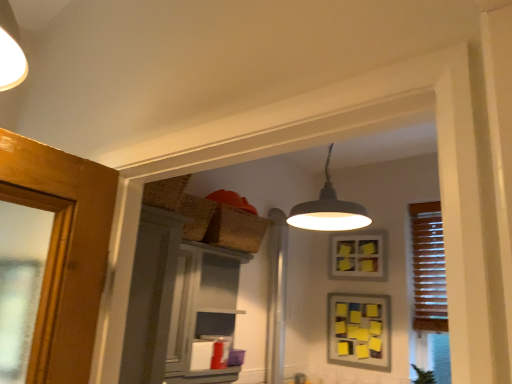
Question: Is matte gray screen door at left aimed at green leafy plant at lower right?

Choices:
 (A) no
 (B) yes

Answer: (B)

Question: From a real-world perspective, is matte gray screen door at left on green leafy plant at lower right?

Choices:
 (A) yes
 (B) no

Answer: (A)

Question: Can you confirm if matte gray screen door at left is smaller than green leafy plant at lower right?

Choices:
 (A) yes
 (B) no

Answer: (B)

Question: Is green leafy plant at lower right inside matte gray screen door at left?

Choices:
 (A) yes
 (B) no

Answer: (B)

Question: From the image's perspective, is matte gray screen door at left on top of green leafy plant at lower right?

Choices:
 (A) no
 (B) yes

Answer: (B)

Question: Would you say yellow paper picture frame at center, the first picture frame ordered from the bottom, is to the left or to the right of woven brown basket at upper center in the picture?

Choices:
 (A) left
 (B) right

Answer: (B)

Question: Is yellow paper picture frame at center, the second picture frame from the top, in front of or behind woven brown basket at upper center in the image?

Choices:
 (A) behind
 (B) front

Answer: (A)

Question: Is yellow paper picture frame at center, the second picture frame from the top, wider or thinner than woven brown basket at upper center?

Choices:
 (A) wide
 (B) thin

Answer: (B)

Question: In terms of height, does yellow paper picture frame at center, the first picture frame ordered from the bottom, look taller or shorter compared to woven brown basket at upper center?

Choices:
 (A) short
 (B) tall

Answer: (B)

Question: Considering the positions of woven brown basket at upper center and green leafy plant at lower right in the image, is woven brown basket at upper center bigger or smaller than green leafy plant at lower right?

Choices:
 (A) small
 (B) big

Answer: (B)

Question: In the image, is woven brown basket at upper center positioned in front of or behind green leafy plant at lower right?

Choices:
 (A) behind
 (B) front

Answer: (B)

Question: Considering the positions of woven brown basket at upper center and green leafy plant at lower right in the image, is woven brown basket at upper center wider or thinner than green leafy plant at lower right?

Choices:
 (A) thin
 (B) wide

Answer: (B)

Question: Would you say woven brown basket at upper center is to the left or to the right of green leafy plant at lower right in the picture?

Choices:
 (A) left
 (B) right

Answer: (A)

Question: From a real-world perspective, relative to wooden blinds at right, is matte gray screen door at left vertically above or below?

Choices:
 (A) below
 (B) above

Answer: (A)

Question: Is matte gray screen door at left wider or thinner than wooden blinds at right?

Choices:
 (A) wide
 (B) thin

Answer: (A)